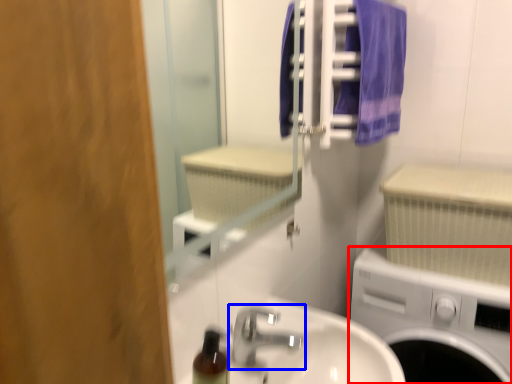
Question: Among these objects, which one is nearest to the camera, washing machine (highlighted by a red box) or tap (highlighted by a blue box)?

Choices:
 (A) washing machine
 (B) tap

Answer: (B)